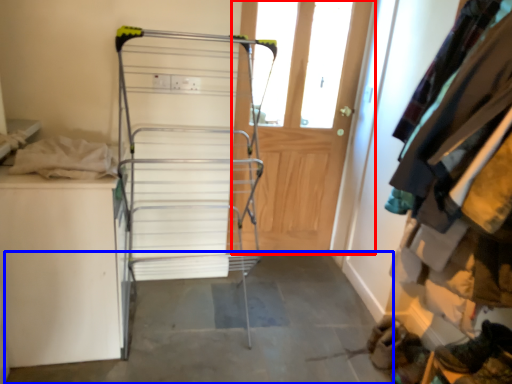
Question: Which of the following is the closest to the observer, door (highlighted by a red box) or concrete (highlighted by a blue box)?

Choices:
 (A) door
 (B) concrete

Answer: (B)